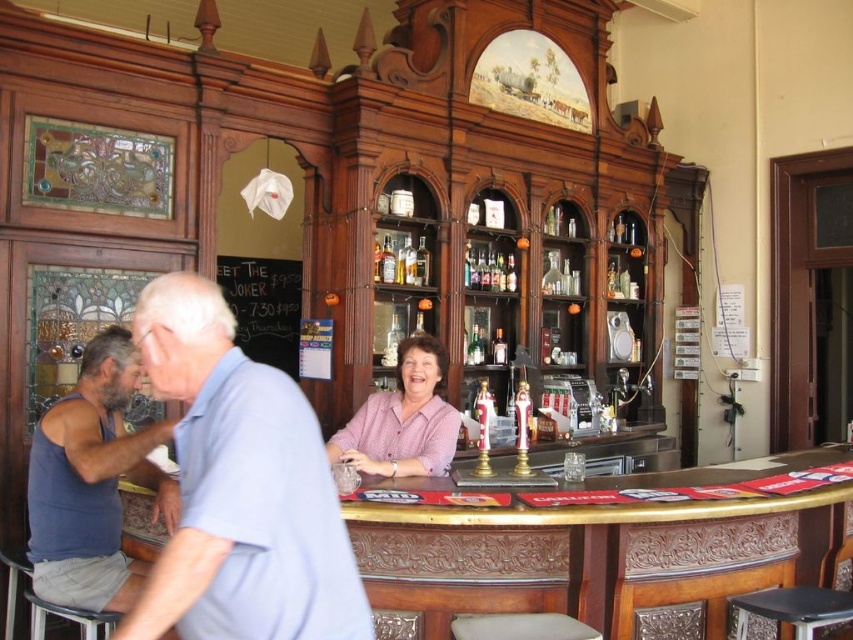
Question: Is pink woven blouse at center to the right of translucent glass bottle at center from the viewer's perspective?

Choices:
 (A) yes
 (B) no

Answer: (B)

Question: Which object appears closest to the camera in this image?

Choices:
 (A) light blue cotton shirt at center
 (B) black leather bar stool at lower right
 (C) pink woven blouse at center

Answer: (A)

Question: Can you confirm if light blue cotton shirt at center is positioned to the right of pink woven blouse at center?

Choices:
 (A) yes
 (B) no

Answer: (B)

Question: Where is blue fabric tank top at lower left located in relation to translucent glass bottle at center in the image?

Choices:
 (A) right
 (B) left

Answer: (B)

Question: Among these objects, which one is nearest to the camera?

Choices:
 (A) pink woven blouse at center
 (B) light blue cotton shirt at center
 (C) black leather bar stool at lower right
 (D) blue fabric tank top at lower left

Answer: (B)

Question: Among these objects, which one is nearest to the camera?

Choices:
 (A) light blue cotton shirt at center
 (B) translucent glass bottle at center
 (C) black leather bar stool at lower right
 (D) pink woven blouse at center

Answer: (A)